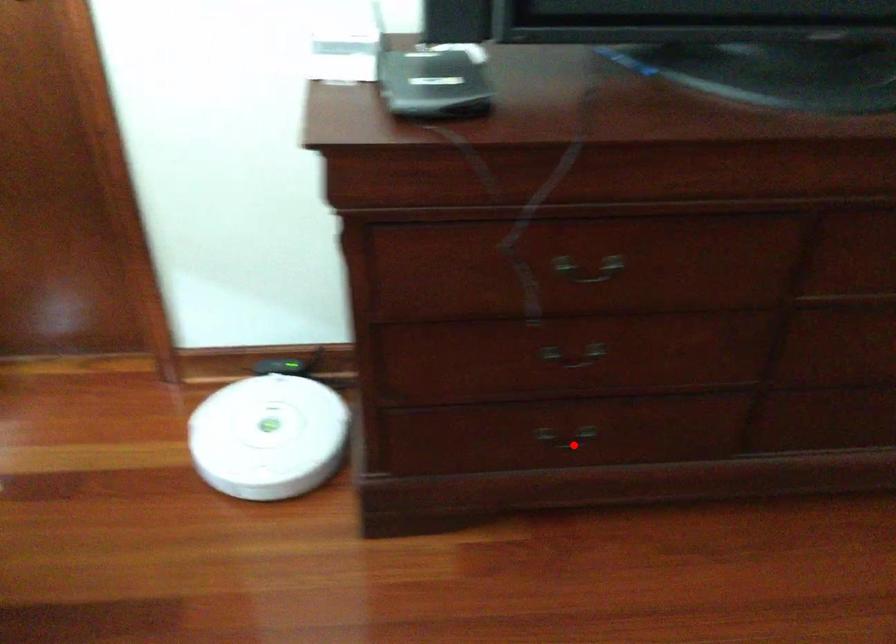
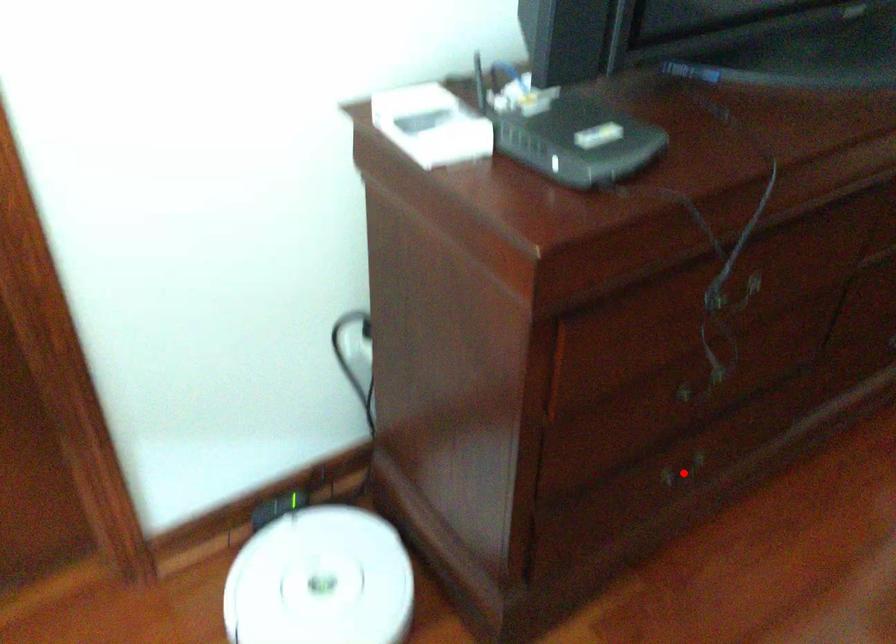
I am providing you with two images of the same scene from different viewpoints. A red point is marked on the first image and another point is marked on the second image. Does the point marked in image1 correspond to the same location as the one in image2?

Yes